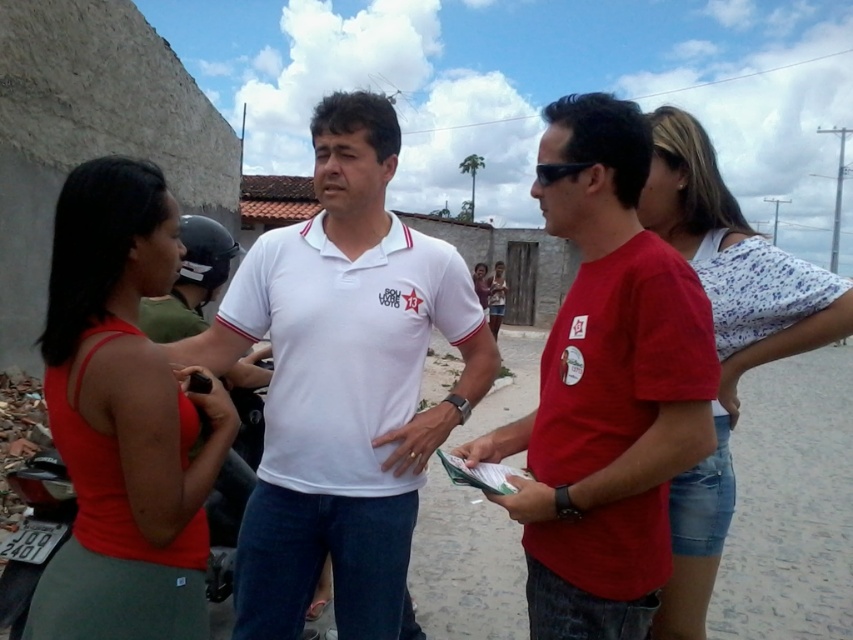
Is white floral blouse at upper right thinner than matte white shirt at center?

Incorrect, white floral blouse at upper right's width is not less than matte white shirt at center's.

Between white floral blouse at upper right and matte white shirt at center, which one appears on the right side from the viewer's perspective?

matte white shirt at center is more to the right.

Describe the element at coordinates (724, 339) in the screenshot. I see `white floral blouse at upper right` at that location.

You are a GUI agent. You are given a task and a screenshot of the screen. Output one action in this format:
    pyautogui.click(x=<x>, y=<y>)
    Task: Click on the white floral blouse at upper right
    
    Given the screenshot: What is the action you would take?
    pyautogui.click(x=724, y=339)

Who is taller, matte red t-shirt at center or matte red tank top at left?

Standing taller between the two is matte red t-shirt at center.

Which is below, matte red t-shirt at center or matte red tank top at left?

Positioned lower is matte red t-shirt at center.

Which is in front, point (570, 218) or point (50, 403)?

Point (50, 403)

Where is `matte red t-shirt at center`? matte red t-shirt at center is located at coordinates (606, 387).

Which is above, matte red t-shirt at center or white floral blouse at upper right?

white floral blouse at upper right is above.

Can you confirm if matte red t-shirt at center is taller than white floral blouse at upper right?

In fact, matte red t-shirt at center may be shorter than white floral blouse at upper right.

Between point (587, 138) and point (682, 186), which one is positioned in front?

Point (587, 138) is more forward.

I want to click on matte red t-shirt at center, so click(x=606, y=387).